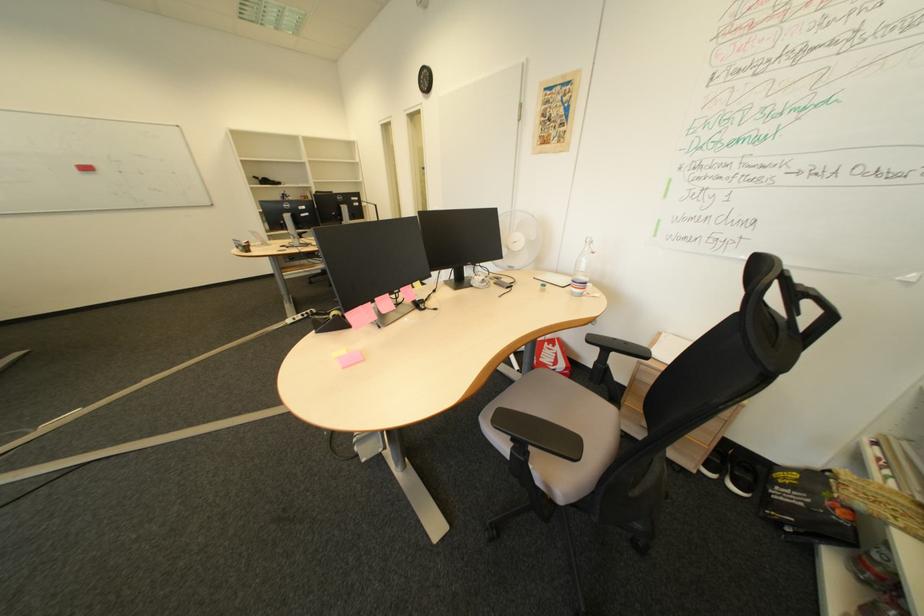
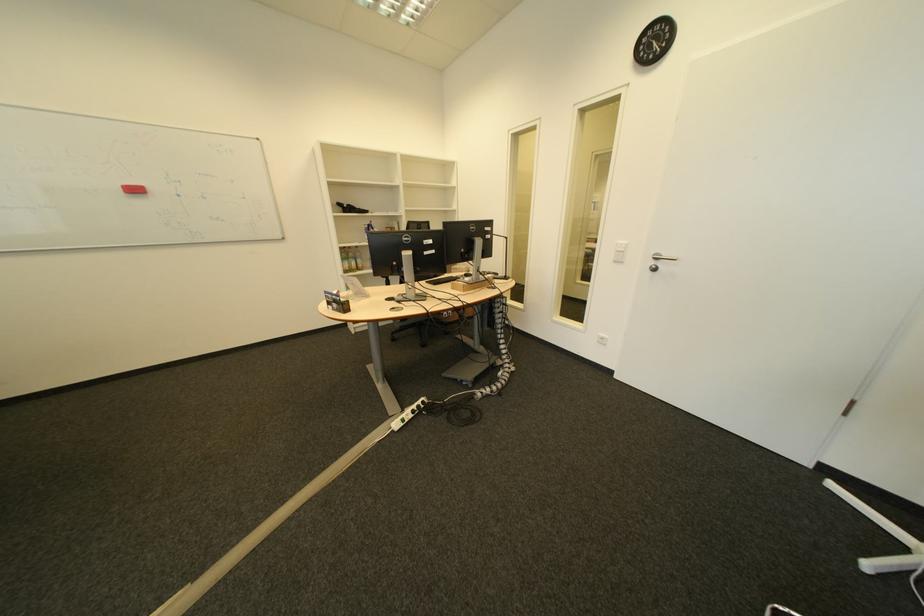
Locate, in the second image, the point that corresponds to point (135, 174) in the first image.

(192, 197)